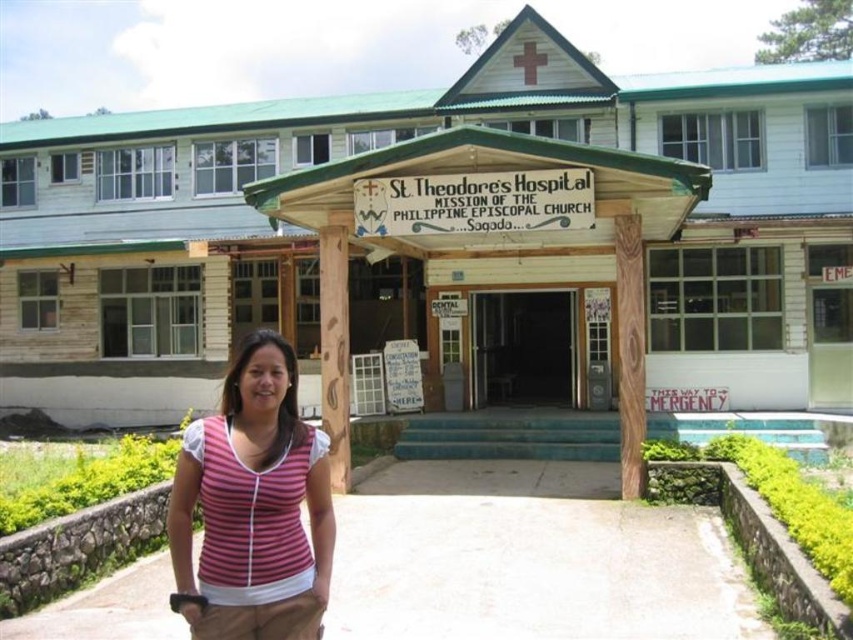
You are a visitor arriving at St. Theodore Hospital and notice the pink striped shirt at lower left and the wooden column at center. From the entrance, which object is positioned to the right of the other?

The pink striped shirt at lower left is to the right of wooden column at center.

You are standing at the entrance of St. Theodore Hospital and notice a pink striped shirt at lower left. Where exactly is the pink striped shirt located in relation to the entrance?

The pink striped shirt at lower left is located at point [254,506] relative to the entrance.

You are standing at the entrance of St. Theodore Hospital and want to take a photo of two points marked on the ground. The first point is at coordinate point [234,576] and the second is at point [347,388]. Which point is closer to you?

Point [234,576] is closer to the viewer than point [347,388].